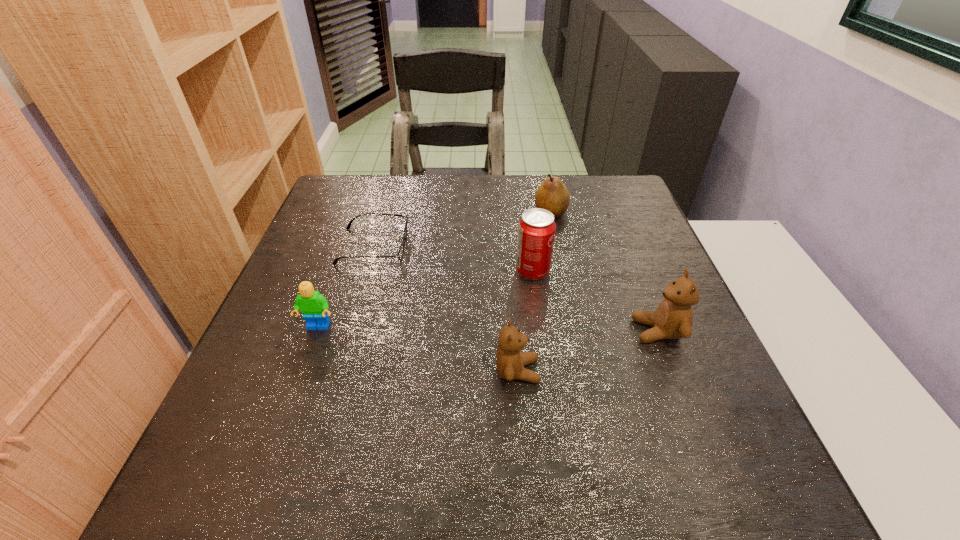
Locate an element on the screen. This screenshot has height=540, width=960. the shorter teddy bear is located at coordinates (510, 360).

At what (x,y) coordinates should I click in order to perform the action: click on the taller teddy bear. Please return your answer as a coordinate pair (x, y). Looking at the image, I should click on (673, 318).

Locate an element on the screen. This screenshot has height=540, width=960. the rightmost object is located at coordinates (673, 318).

This screenshot has width=960, height=540. I want to click on spectacles, so tap(401, 250).

You are a GUI agent. You are given a task and a screenshot of the screen. Output one action in this format:
    pyautogui.click(x=<x>, y=<y>)
    Task: Click on the pear
    
    Given the screenshot: What is the action you would take?
    pyautogui.click(x=552, y=195)

Where is `soda`? soda is located at coordinates (536, 230).

Find the location of a particular element. This screenshot has width=960, height=540. Lego is located at coordinates (314, 306).

In order to click on vacant space located 0.180m on the front-facing side of the left teddy bear in this screenshot , I will do `click(634, 371)`.

Identify the location of vacant space situated 0.110m on the front-facing side of the taller teddy bear. (581, 331).

You are a GUI agent. You are given a task and a screenshot of the screen. Output one action in this format:
    pyautogui.click(x=<x>, y=<y>)
    Task: Click on the vacant region located 0.050m on the front-facing side of the taller teddy bear
    This screenshot has height=540, width=960.
    Given the screenshot: What is the action you would take?
    pyautogui.click(x=610, y=331)